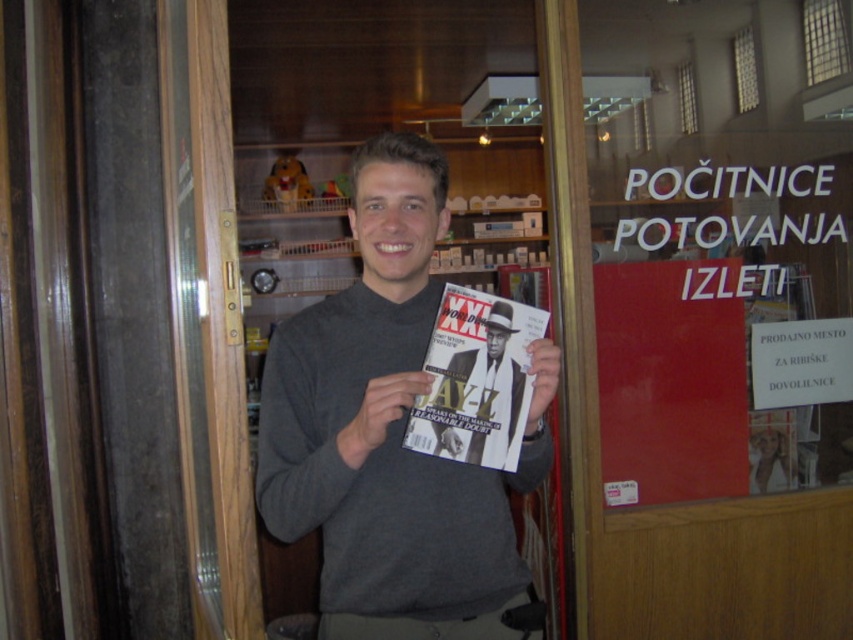
Does gray sweater at center have a lesser width compared to matte paper magazine at center?

Incorrect, gray sweater at center's width is not less than matte paper magazine at center's.

Who is more distant from viewer, (x=438, y=616) or (x=415, y=440)?

Positioned behind is point (x=438, y=616).

I want to click on gray sweater at center, so (x=390, y=433).

Who is positioned more to the left, gray sweater at center or red paper poster at right?

gray sweater at center

Measure the distance between gray sweater at center and red paper poster at right.

They are 35.19 inches apart.

Where is `gray sweater at center`? Image resolution: width=853 pixels, height=640 pixels. gray sweater at center is located at coordinates (390, 433).

Does red paper poster at right have a larger size compared to matte paper magazine at center?

Yes.

Is red paper poster at right positioned at the back of matte paper magazine at center?

Yes, it is.

The image size is (853, 640). In order to click on red paper poster at right in this screenshot , I will do `click(718, 330)`.